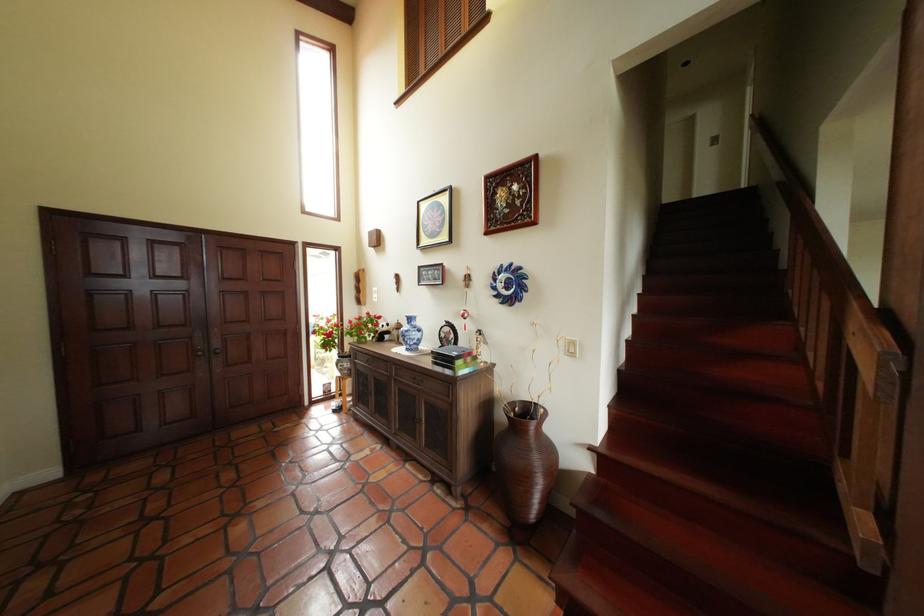
Where is `wooden stair handrail`? The height and width of the screenshot is (616, 924). wooden stair handrail is located at coordinates (885, 375).